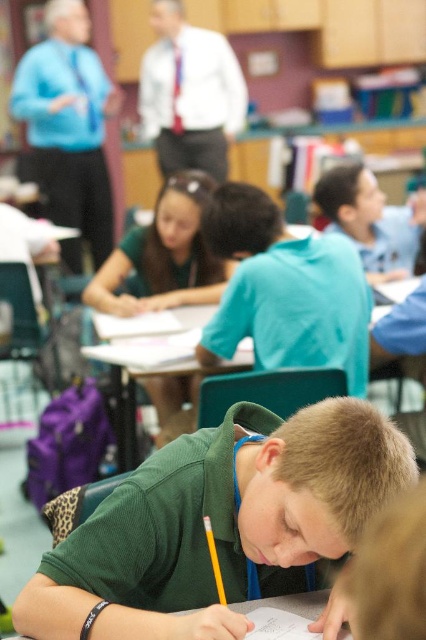
You are a student who needs to place a 10 cm tall textbook on the wooden desk at center. Can the textbook fit vertically on the white paper at lower center without overlapping the edges?

The wooden desk at center is much taller than the white paper at lower center. Since the textbook is 10 cm tall, it may not fit vertically on the white paper at lower center due to its smaller size compared to the desk.

You are a student who needs to hand in an assignment. You are standing 2 meters away from the wooden desk at center. Can you reach the desk without moving closer?

The wooden desk at center is 1.99 meters away from the camera, so you are standing 2 meters away from it. Since you are slightly farther than the desk, you might not be able to reach it without moving closer.

You are a teacher observing the classroom. You notice the green matte shirt at center and the wooden desk at center. Which object takes up more area in the image?

The wooden desk at center takes up more area in the image because the green matte shirt at center occupies less space than the wooden desk at center.